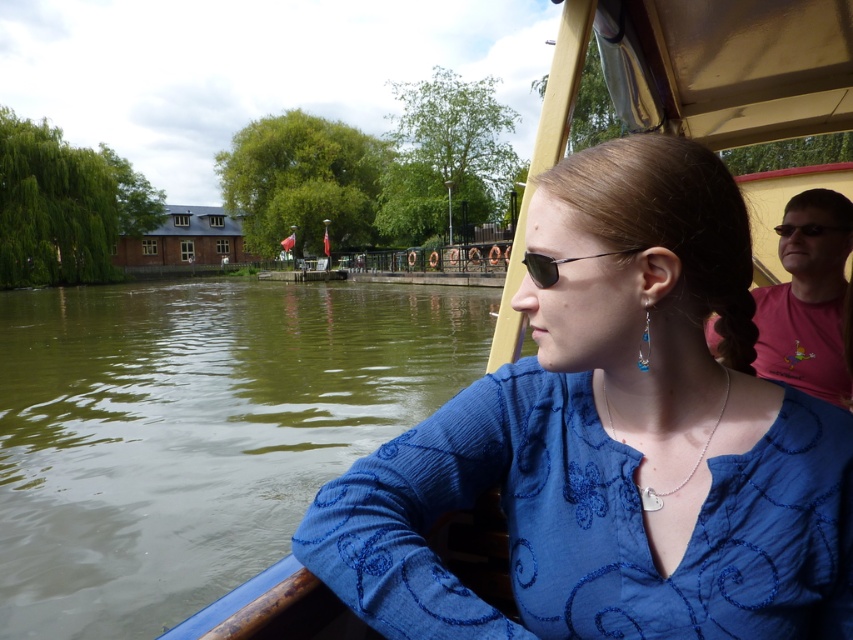
Question: Does silver/chain necklace at center appear on the left side of black plastic sunglasses at center?

Choices:
 (A) yes
 (B) no

Answer: (B)

Question: Is blue knitted sweater at center positioned at the back of green water at left?

Choices:
 (A) no
 (B) yes

Answer: (A)

Question: Which point is closer to the camera taking this photo?

Choices:
 (A) (602, 385)
 (B) (589, 256)

Answer: (B)

Question: Which point appears closest to the camera in this image?

Choices:
 (A) (363, 611)
 (B) (242, 609)
 (C) (524, 260)

Answer: (A)

Question: Which point is closer to the camera?

Choices:
 (A) (335, 358)
 (B) (735, 500)
 (C) (567, 259)
 (D) (712, 432)

Answer: (B)

Question: Does blue textured fabric at lower left appear under black plastic sunglasses at center?

Choices:
 (A) no
 (B) yes

Answer: (B)